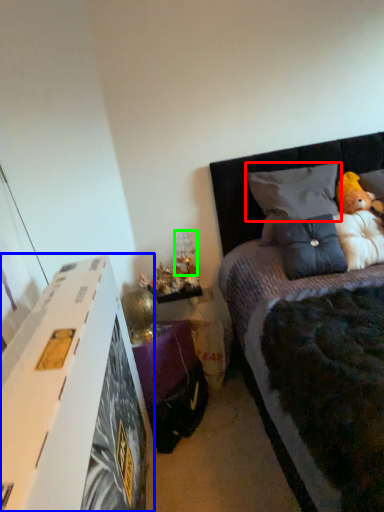
Question: Based on their relative distances, which object is farther from pillow (highlighted by a red box)? Choose from nightstand (highlighted by a blue box) and lamp (highlighted by a green box).

Choices:
 (A) nightstand
 (B) lamp

Answer: (A)